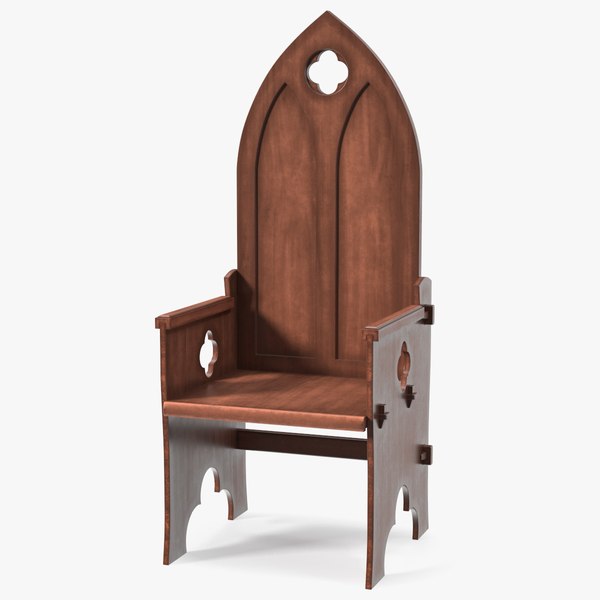
Image resolution: width=600 pixels, height=600 pixels. I want to click on dark wooden back rest, so click(x=324, y=210).